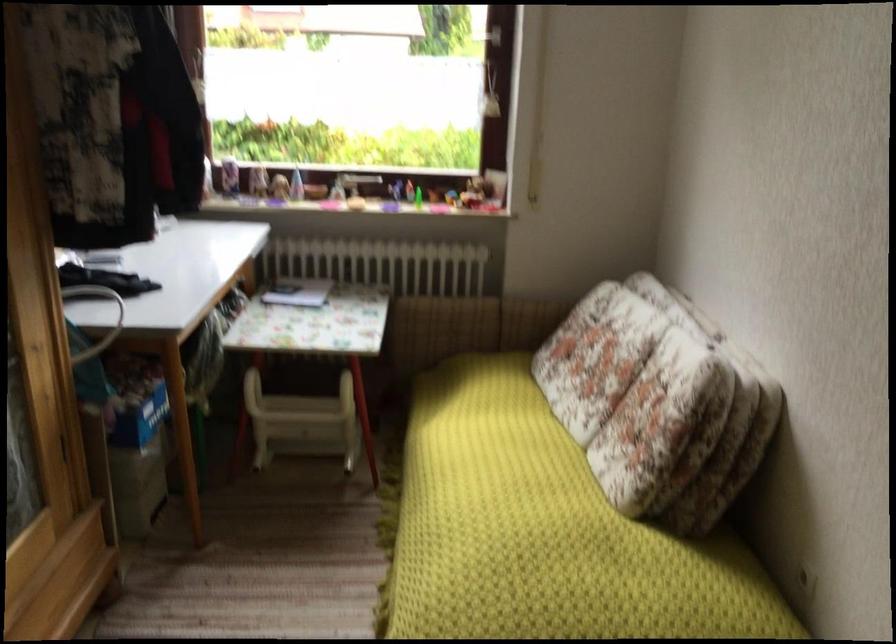
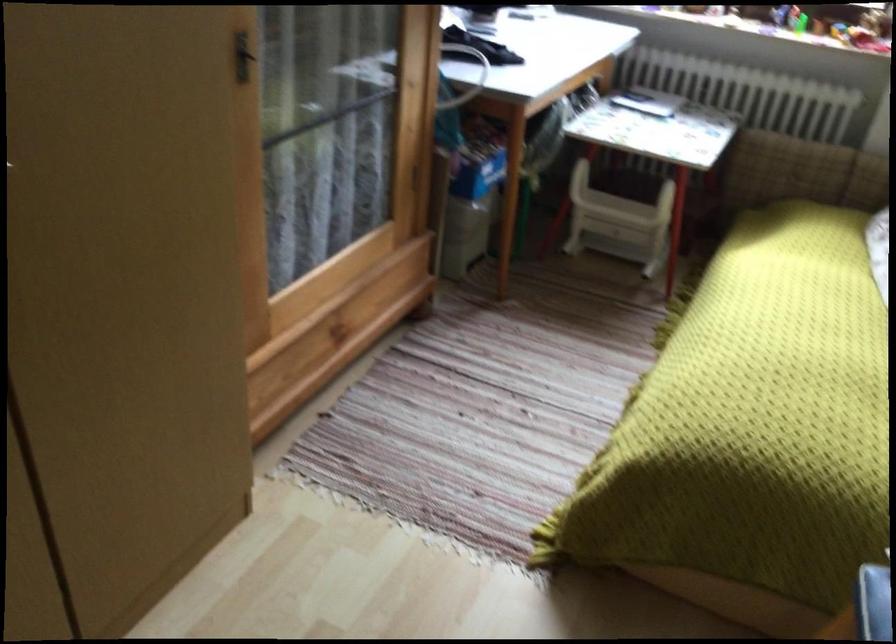
Question: The camera is either moving clockwise (left) or counter-clockwise (right) around the object. The first image is from the beginning of the video and the second image is from the end. Is the camera moving left or right when shooting the video?

Choices:
 (A) Left
 (B) Right

Answer: (B)